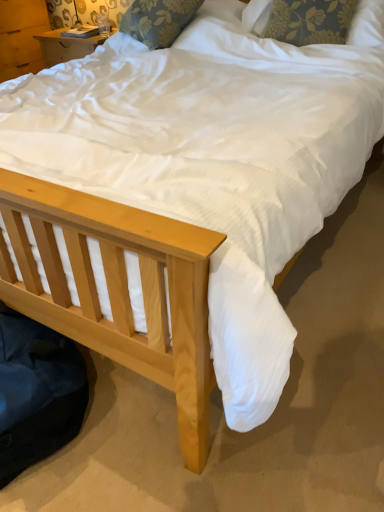
The width and height of the screenshot is (384, 512). What do you see at coordinates (303, 20) in the screenshot? I see `floral fabric pillow at upper center, acting as the first pillow starting from the right` at bounding box center [303, 20].

Locate an element on the screen. floral fabric pillow at upper center, the second pillow in the left-to-right sequence is located at coordinates (303, 20).

The height and width of the screenshot is (512, 384). Describe the element at coordinates (158, 20) in the screenshot. I see `floral fabric pillow at upper center, marked as the 1th pillow in a left-to-right arrangement` at that location.

At what (x,y) coordinates should I click in order to perform the action: click on floral fabric pillow at upper center, marked as the 1th pillow in a left-to-right arrangement. Please return your answer as a coordinate pair (x, y). Looking at the image, I should click on (158, 20).

Where is `floral fabric pillow at upper center, the second pillow in the left-to-right sequence`? This screenshot has height=512, width=384. floral fabric pillow at upper center, the second pillow in the left-to-right sequence is located at coordinates (303, 20).

Which is more to the left, floral fabric pillow at upper center, the second pillow in the left-to-right sequence, or floral fabric pillow at upper center, acting as the second pillow starting from the right?

floral fabric pillow at upper center, acting as the second pillow starting from the right, is more to the left.

Looking at this image, is floral fabric pillow at upper center, acting as the first pillow starting from the right, further to camera compared to floral fabric pillow at upper center, marked as the 1th pillow in a left-to-right arrangement?

No, the depth of floral fabric pillow at upper center, acting as the first pillow starting from the right, is less than that of floral fabric pillow at upper center, marked as the 1th pillow in a left-to-right arrangement.

Is point (325, 7) in front of point (156, 29)?

Yes, it is in front of point (156, 29).

From the image's perspective, which one is positioned lower, floral fabric pillow at upper center, the second pillow in the left-to-right sequence, or floral fabric pillow at upper center, marked as the 1th pillow in a left-to-right arrangement?

floral fabric pillow at upper center, the second pillow in the left-to-right sequence, is shown below in the image.

From a real-world perspective, is floral fabric pillow at upper center, the second pillow in the left-to-right sequence, above or below floral fabric pillow at upper center, acting as the second pillow starting from the right?

Clearly, from a real-world perspective, floral fabric pillow at upper center, the second pillow in the left-to-right sequence, is below floral fabric pillow at upper center, acting as the second pillow starting from the right.

Consider the image. Does floral fabric pillow at upper center, acting as the first pillow starting from the right, have a greater width compared to floral fabric pillow at upper center, marked as the 1th pillow in a left-to-right arrangement?

No.

Considering the sizes of floral fabric pillow at upper center, the second pillow in the left-to-right sequence, and floral fabric pillow at upper center, marked as the 1th pillow in a left-to-right arrangement, in the image, is floral fabric pillow at upper center, the second pillow in the left-to-right sequence, taller or shorter than floral fabric pillow at upper center, marked as the 1th pillow in a left-to-right arrangement,?

In the image, floral fabric pillow at upper center, the second pillow in the left-to-right sequence, appears to be taller than floral fabric pillow at upper center, marked as the 1th pillow in a left-to-right arrangement.

Considering the sizes of objects floral fabric pillow at upper center, the second pillow in the left-to-right sequence, and floral fabric pillow at upper center, marked as the 1th pillow in a left-to-right arrangement, in the image provided, who is smaller, floral fabric pillow at upper center, the second pillow in the left-to-right sequence, or floral fabric pillow at upper center, marked as the 1th pillow in a left-to-right arrangement,?

floral fabric pillow at upper center, the second pillow in the left-to-right sequence.

Is floral fabric pillow at upper center, the second pillow in the left-to-right sequence, outside of floral fabric pillow at upper center, marked as the 1th pillow in a left-to-right arrangement?

Indeed, floral fabric pillow at upper center, the second pillow in the left-to-right sequence, is completely outside floral fabric pillow at upper center, marked as the 1th pillow in a left-to-right arrangement.

Is floral fabric pillow at upper center, the second pillow in the left-to-right sequence, with floral fabric pillow at upper center, marked as the 1th pillow in a left-to-right arrangement?

floral fabric pillow at upper center, the second pillow in the left-to-right sequence, and floral fabric pillow at upper center, marked as the 1th pillow in a left-to-right arrangement, are clearly separated.

Is floral fabric pillow at upper center, acting as the first pillow starting from the right, facing away from floral fabric pillow at upper center, marked as the 1th pillow in a left-to-right arrangement?

That's not correct — floral fabric pillow at upper center, acting as the first pillow starting from the right, is not looking away from floral fabric pillow at upper center, marked as the 1th pillow in a left-to-right arrangement.

The image size is (384, 512). I want to click on pillow that is on the left side of floral fabric pillow at upper center, acting as the first pillow starting from the right, so click(158, 20).

Is floral fabric pillow at upper center, acting as the second pillow starting from the right, to the left of floral fabric pillow at upper center, the second pillow in the left-to-right sequence, from the viewer's perspective?

Yes.

Between floral fabric pillow at upper center, acting as the second pillow starting from the right, and floral fabric pillow at upper center, the second pillow in the left-to-right sequence, which one is positioned in front?

floral fabric pillow at upper center, the second pillow in the left-to-right sequence, is in front.

Considering the points (133, 11) and (303, 25), which point is in front, point (133, 11) or point (303, 25)?

The point (303, 25) is more forward.

In the scene shown: From the image's perspective, between floral fabric pillow at upper center, marked as the 1th pillow in a left-to-right arrangement, and floral fabric pillow at upper center, the second pillow in the left-to-right sequence, who is located below?

From the image's view, floral fabric pillow at upper center, the second pillow in the left-to-right sequence, is below.

From a real-world perspective, which is physically above, floral fabric pillow at upper center, acting as the second pillow starting from the right, or floral fabric pillow at upper center, acting as the first pillow starting from the right?

floral fabric pillow at upper center, acting as the second pillow starting from the right.

Considering the sizes of objects floral fabric pillow at upper center, acting as the second pillow starting from the right, and floral fabric pillow at upper center, acting as the first pillow starting from the right, in the image provided, who is wider, floral fabric pillow at upper center, acting as the second pillow starting from the right, or floral fabric pillow at upper center, acting as the first pillow starting from the right,?

floral fabric pillow at upper center, acting as the second pillow starting from the right, is wider.

In terms of height, does floral fabric pillow at upper center, marked as the 1th pillow in a left-to-right arrangement, look taller or shorter compared to floral fabric pillow at upper center, the second pillow in the left-to-right sequence?

floral fabric pillow at upper center, marked as the 1th pillow in a left-to-right arrangement, is shorter than floral fabric pillow at upper center, the second pillow in the left-to-right sequence.

Who is smaller, floral fabric pillow at upper center, marked as the 1th pillow in a left-to-right arrangement, or floral fabric pillow at upper center, acting as the first pillow starting from the right?

With smaller size is floral fabric pillow at upper center, acting as the first pillow starting from the right.

Would you say floral fabric pillow at upper center, marked as the 1th pillow in a left-to-right arrangement, is outside floral fabric pillow at upper center, the second pillow in the left-to-right sequence?

floral fabric pillow at upper center, marked as the 1th pillow in a left-to-right arrangement, lies outside floral fabric pillow at upper center, the second pillow in the left-to-right sequence,'s area.

Does floral fabric pillow at upper center, acting as the second pillow starting from the right, touch floral fabric pillow at upper center, acting as the first pillow starting from the right?

They are not placed beside each other.

Does floral fabric pillow at upper center, acting as the second pillow starting from the right, turn towards floral fabric pillow at upper center, the second pillow in the left-to-right sequence?

No, floral fabric pillow at upper center, acting as the second pillow starting from the right, is not oriented towards floral fabric pillow at upper center, the second pillow in the left-to-right sequence.

Locate an element on the screen. pillow located in front of the floral fabric pillow at upper center, acting as the second pillow starting from the right is located at coordinates (303, 20).

Locate an element on the screen. The width and height of the screenshot is (384, 512). pillow below the floral fabric pillow at upper center, acting as the second pillow starting from the right (from the image's perspective) is located at coordinates (303, 20).

Identify the location of pillow located underneath the floral fabric pillow at upper center, marked as the 1th pillow in a left-to-right arrangement (from a real-world perspective). This screenshot has height=512, width=384. (303, 20).